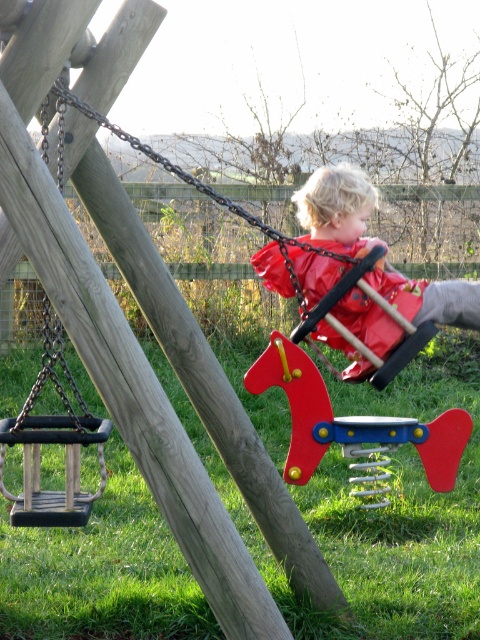
You are standing at the playground and want to know which of the two points, point [340,198] or point [94,115], is closer to you. Based on the image, which point is nearer?

Point [340,198] is closer to you because it is further to the camera than point [94,115].

You are standing at the center of the playground and want to reach the red plastic spring at center. According to the coordinates provided, in which direction should you move from your current position to reach it?

The red plastic spring at center is located at coordinates point (350, 420), so you should move towards the lower right direction from the center to reach it.